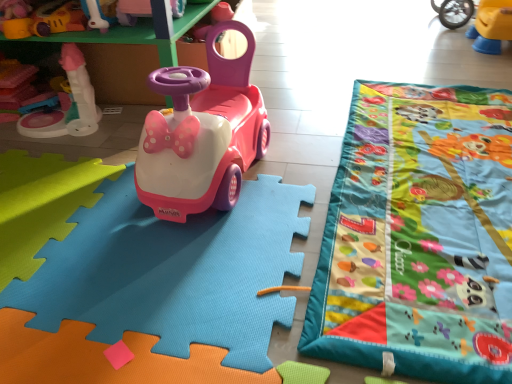
The height and width of the screenshot is (384, 512). Find the location of `free space behind pink plastic car at center, which is the 5th toy in top-to-bottom order`. free space behind pink plastic car at center, which is the 5th toy in top-to-bottom order is located at coordinates (302, 92).